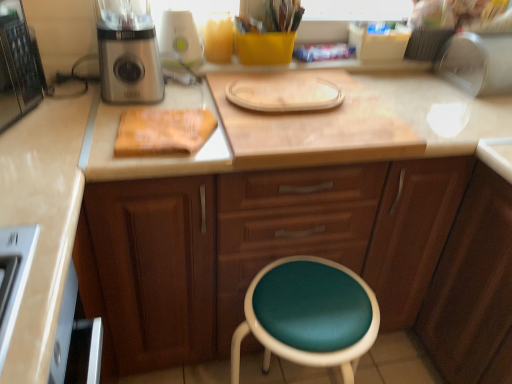
Locate an element on the screen. free space above wooden cutting board at center (from a real-world perspective) is located at coordinates (308, 110).